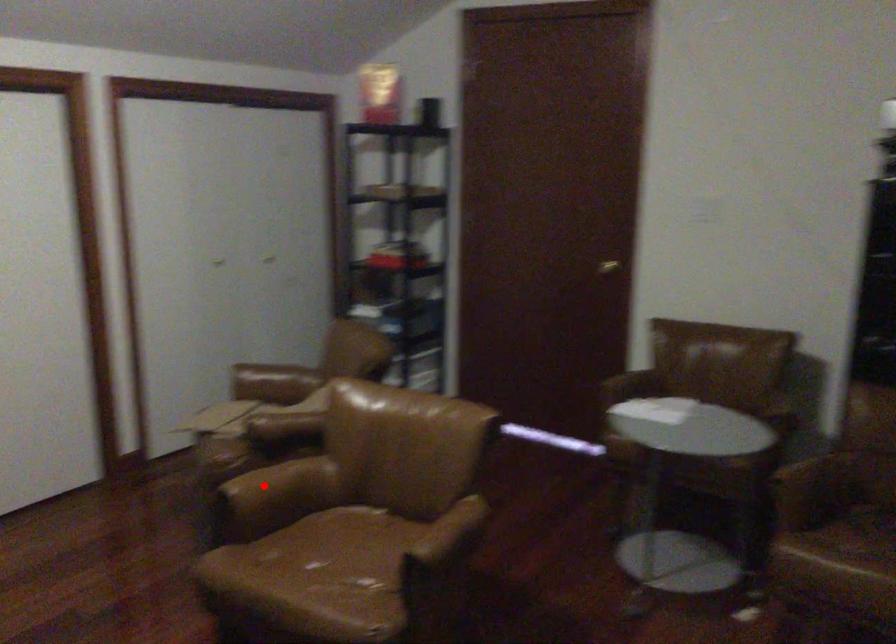
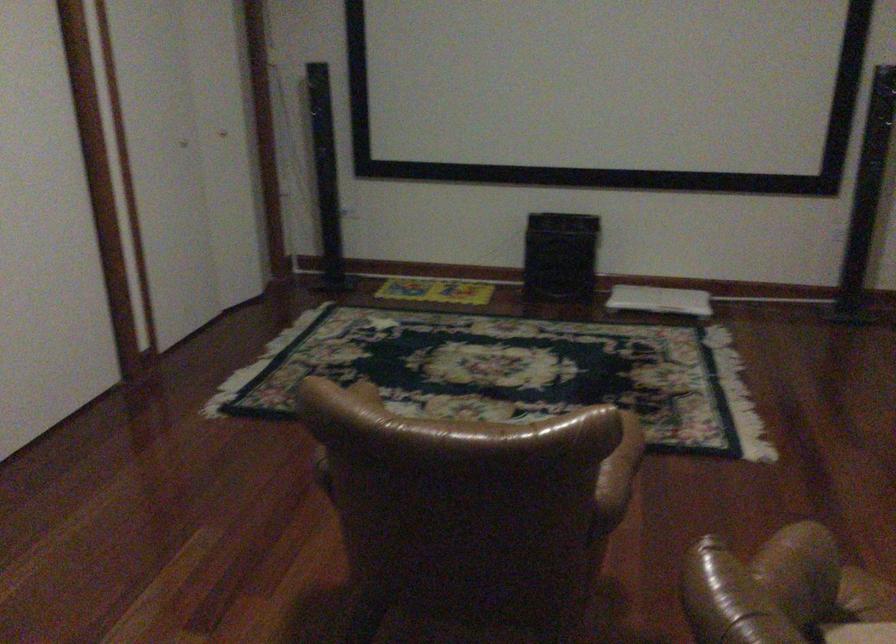
Where in the second image is the point corresponding to the highlighted location from the first image?

(622, 460)